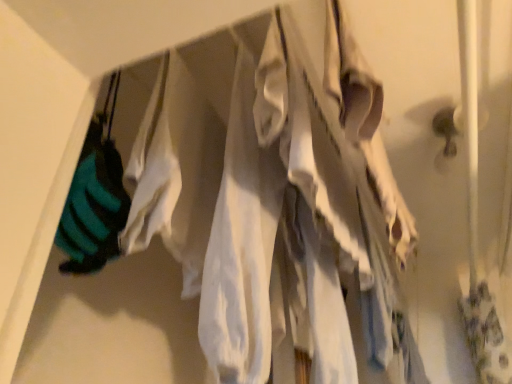
What do you see at coordinates (449, 127) in the screenshot? I see `metallic silver door handle at upper right` at bounding box center [449, 127].

Where is `metallic silver door handle at upper right`? metallic silver door handle at upper right is located at coordinates (449, 127).

Find the location of a particular element. The height and width of the screenshot is (384, 512). metallic silver door handle at upper right is located at coordinates (449, 127).